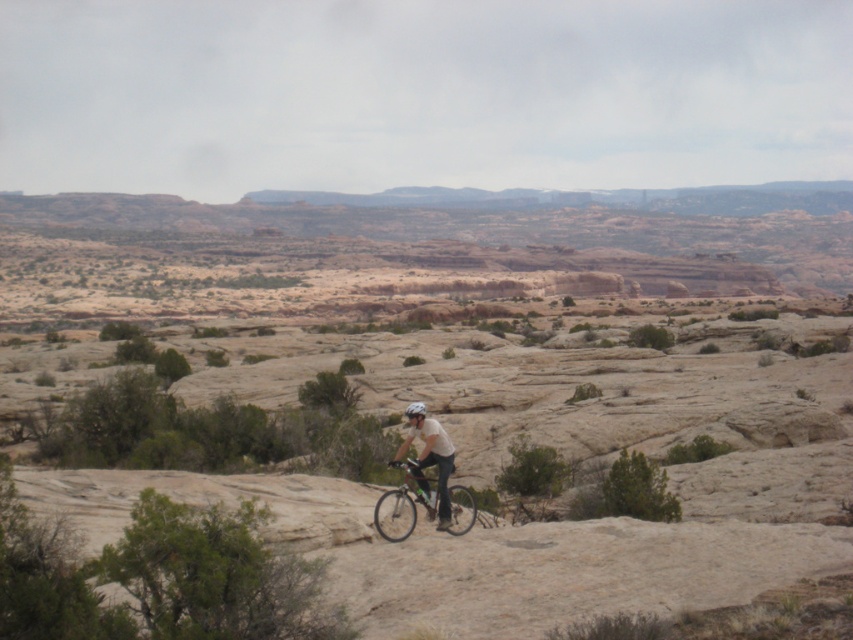
Question: Is green leafy bush at lower left thinner than shiny silver helmet at center?

Choices:
 (A) no
 (B) yes

Answer: (A)

Question: Which of these objects is positioned closest to the desert sandstone terrain at center?

Choices:
 (A) shiny silver helmet at center
 (B) green leafy bush at lower left

Answer: (B)

Question: Among these points, which one is farthest from the camera?

Choices:
 (A) (405, 513)
 (B) (619, 566)

Answer: (A)

Question: Where is green leafy bush at lower left located in relation to white matte helmet at center in the image?

Choices:
 (A) right
 (B) left

Answer: (B)

Question: Which object appears closest to the camera in this image?

Choices:
 (A) green leafy bush at lower left
 (B) white matte helmet at center

Answer: (A)

Question: Does green leafy bush at lower left have a larger size compared to metallic silver bicycle at center?

Choices:
 (A) no
 (B) yes

Answer: (B)